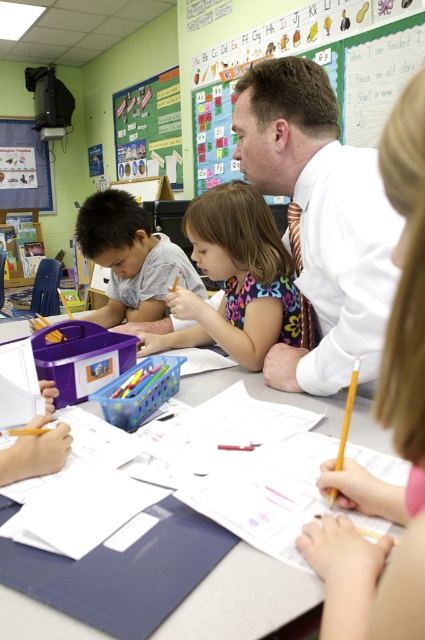
Can you confirm if green paperboard at upper center is bigger than matte gray shirt at left?

Correct, green paperboard at upper center is larger in size than matte gray shirt at left.

Does green paperboard at upper center have a smaller size compared to matte gray shirt at left?

Incorrect, green paperboard at upper center is not smaller in size than matte gray shirt at left.

Is point (405, 58) behind point (108, 248)?

Yes, point (405, 58) is farther from viewer.

This screenshot has height=640, width=425. Identify the location of green paperboard at upper center. (370, 72).

Between white paper at center and multicolored fabric dress at center, which one has less height?

With less height is white paper at center.

Find the location of `white paper at center`. white paper at center is located at coordinates (243, 600).

Between point (274, 168) and point (87, 205), which one is positioned in front?

Positioned in front is point (274, 168).

Who is more forward, (277, 172) or (138, 209)?

Point (277, 172)

This screenshot has height=640, width=425. Find the location of `white shirt at upper center`. white shirt at upper center is located at coordinates (320, 220).